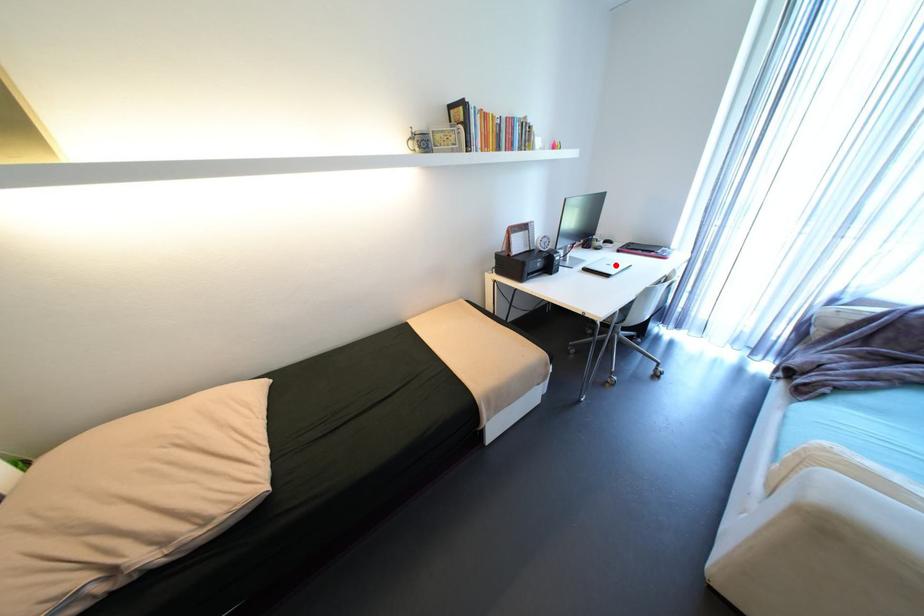
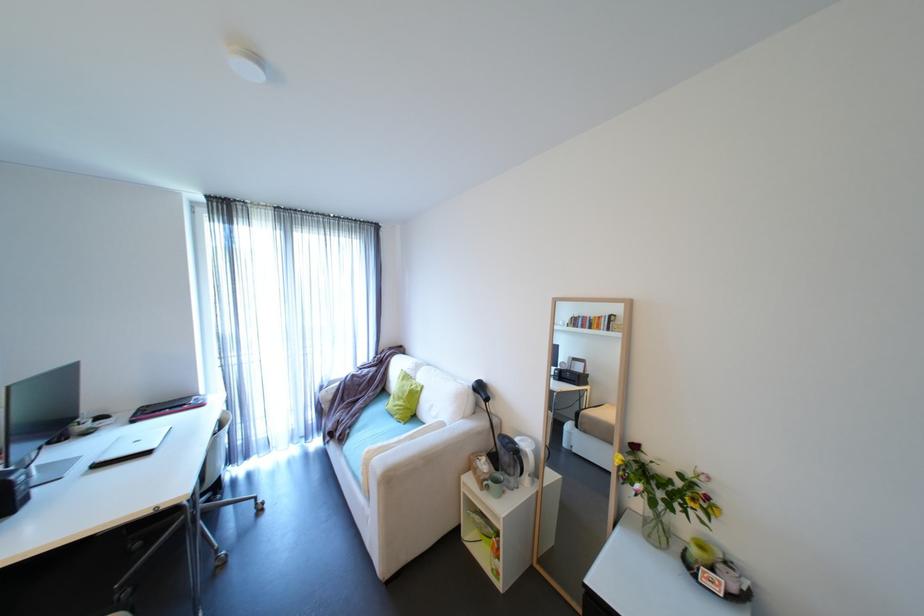
In the second image, find the point that corresponds to the highlighted location in the first image.

(144, 440)